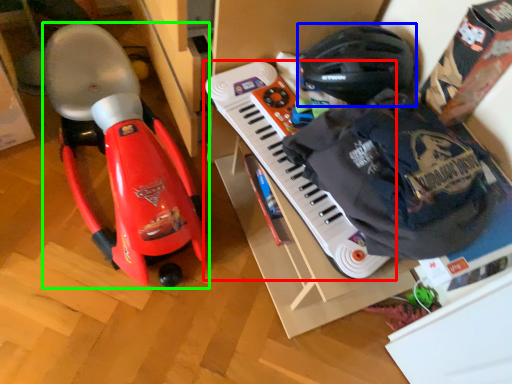
Question: Which object is the closest to the musical keyboard (highlighted by a red box)? Choose among these: helmet (highlighted by a blue box) or toy (highlighted by a green box).

Choices:
 (A) helmet
 (B) toy

Answer: (A)